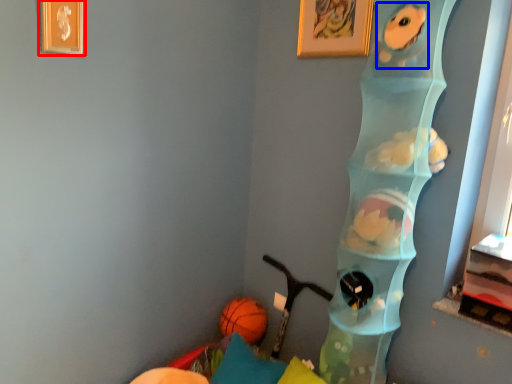
Question: Which of the following is the farthest to the observer, picture frame (highlighted by a red box) or animal (highlighted by a blue box)?

Choices:
 (A) picture frame
 (B) animal

Answer: (A)